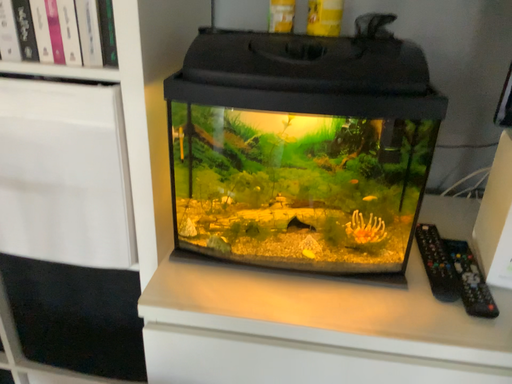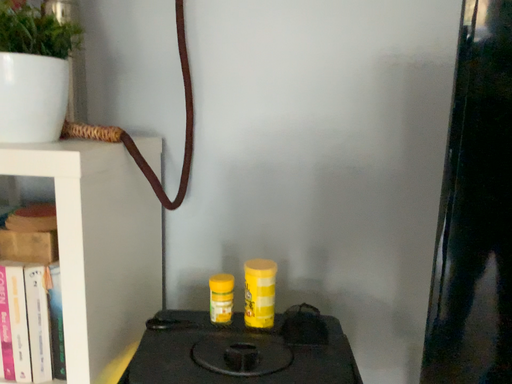
Question: How did the camera likely rotate when shooting the video?

Choices:
 (A) rotated upward
 (B) rotated downward

Answer: (A)